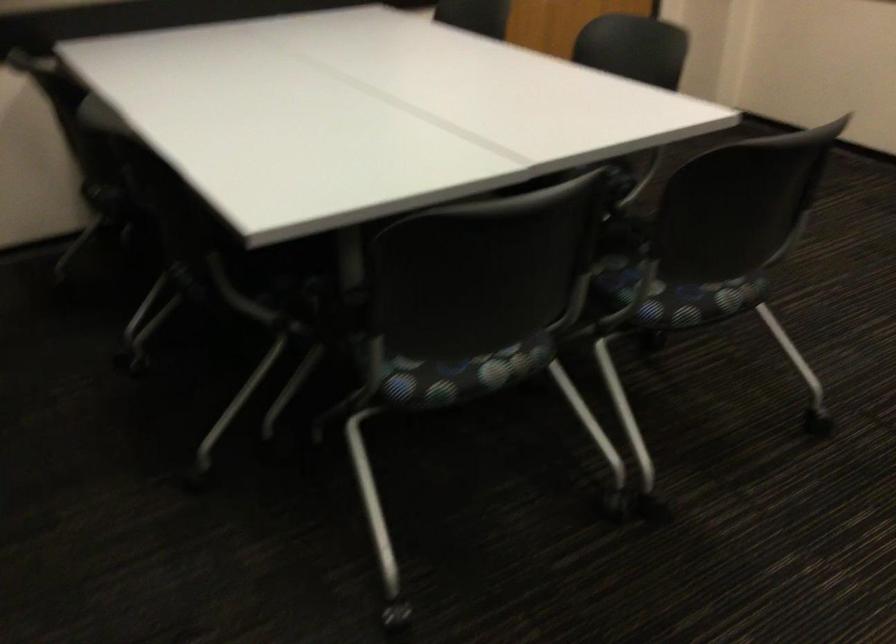
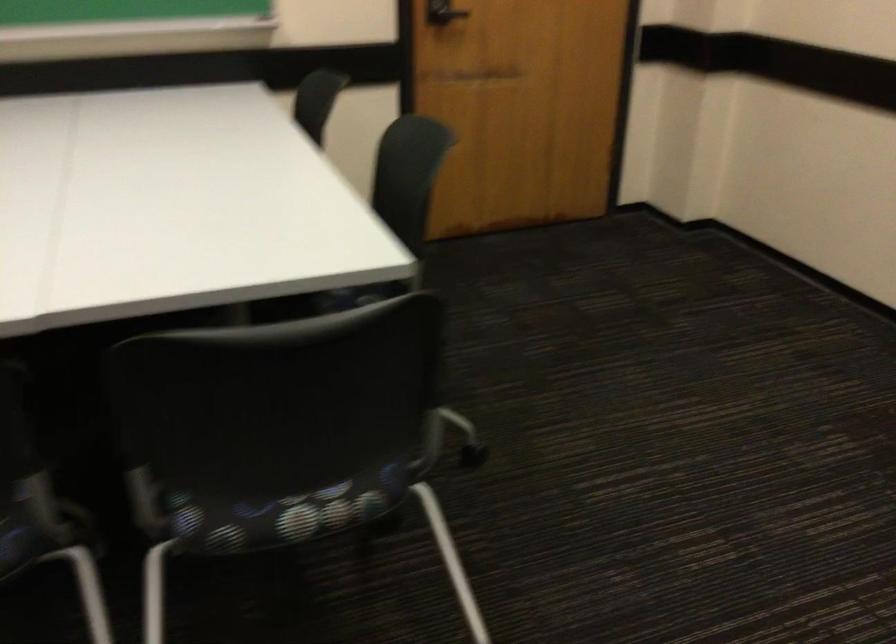
Based on the photo, in a continuous first-person perspective shot, in which direction is the camera moving?

The cameraman moved toward right, forward.